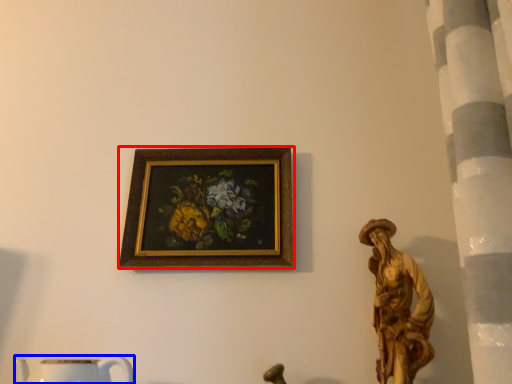
Question: Which object appears farthest to the camera in this image, picture frame (highlighted by a red box) or mug (highlighted by a blue box)?

Choices:
 (A) picture frame
 (B) mug

Answer: (A)